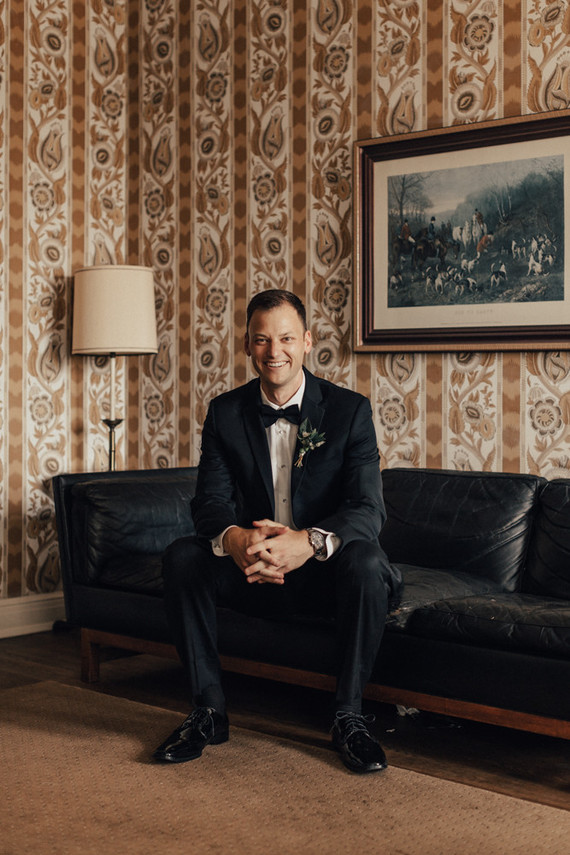
In order to click on wallpaper in this screenshot , I will do `click(418, 435)`.